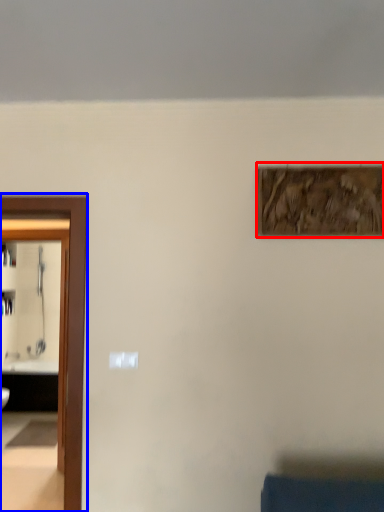
Question: Which of the following is the closest to the observer, picture frame (highlighted by a red box) or elevator (highlighted by a blue box)?

Choices:
 (A) picture frame
 (B) elevator

Answer: (B)